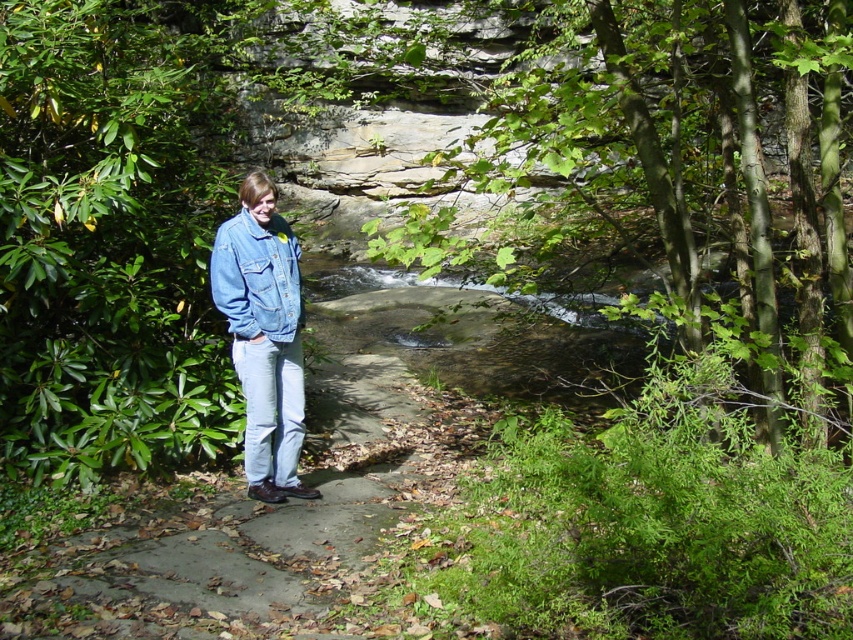
Question: Can you confirm if denim jacket at center is positioned above denim jacket at lower right?

Choices:
 (A) yes
 (B) no

Answer: (B)

Question: Which point is closer to the camera?

Choices:
 (A) denim jacket at center
 (B) denim jacket at lower right

Answer: (A)

Question: Does denim jacket at center appear over denim jacket at lower right?

Choices:
 (A) no
 (B) yes

Answer: (A)

Question: Which point is closer to the camera taking this photo?

Choices:
 (A) (285, 241)
 (B) (212, 273)

Answer: (B)

Question: Is denim jacket at center thinner than denim jacket at lower right?

Choices:
 (A) no
 (B) yes

Answer: (A)